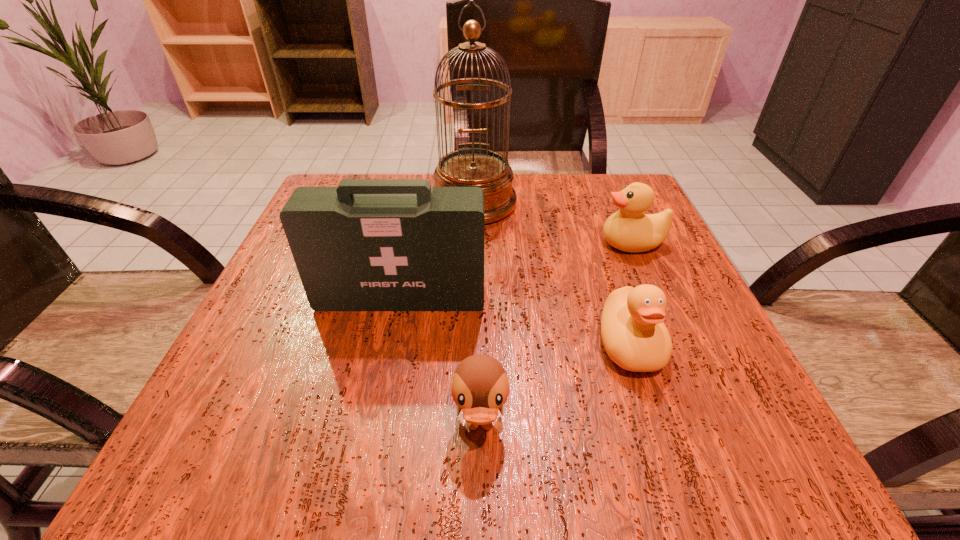
This screenshot has width=960, height=540. What are the coordinates of `blank area at the far right corner` in the screenshot? It's located at (594, 198).

The image size is (960, 540). In order to click on vacant area at the near right corner of the desktop in this screenshot , I will do pyautogui.click(x=704, y=418).

At what (x,y) coordinates should I click in order to perform the action: click on free space between the nearest object and the second nearest object. Please return your answer as a coordinate pair (x, y). Looking at the image, I should click on (555, 385).

Image resolution: width=960 pixels, height=540 pixels. I want to click on free space between the fourth nearest object and the nearest duck, so click(x=556, y=334).

Find the location of a particular element. This screenshot has width=960, height=540. vacant point located between the second tallest object and the fourth nearest object is located at coordinates (516, 270).

Identify the location of vacant area that lies between the second tallest object and the nearest object. This screenshot has height=540, width=960. (441, 362).

Image resolution: width=960 pixels, height=540 pixels. Identify the location of empty space between the fourth nearest object and the birdcage. (553, 223).

I want to click on empty location between the farthest duck and the fourth shortest object, so click(x=516, y=270).

Identify the location of free area in between the farthest duck and the tallest object. The height and width of the screenshot is (540, 960). (553, 223).

I want to click on vacant area that lies between the nearest duck and the third nearest object, so click(x=441, y=362).